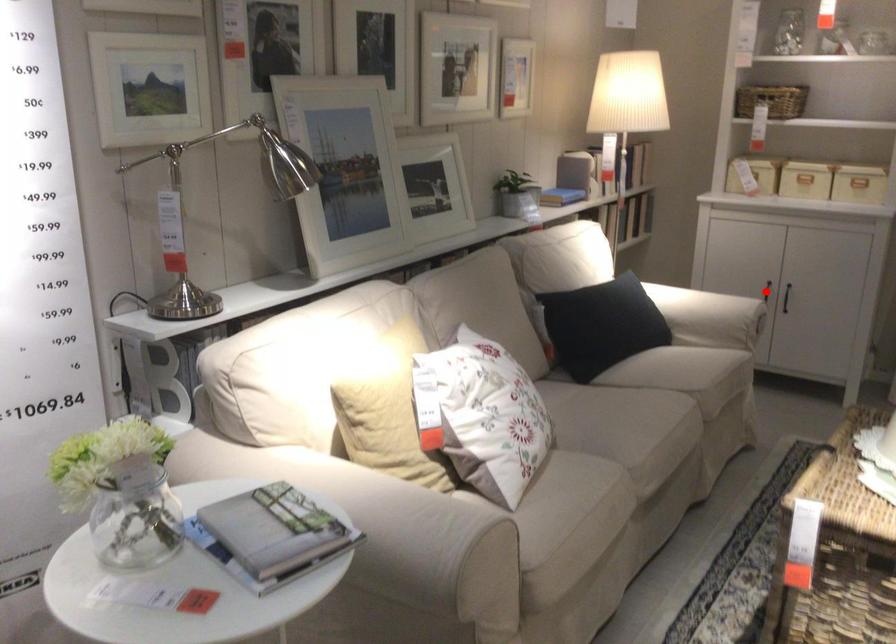
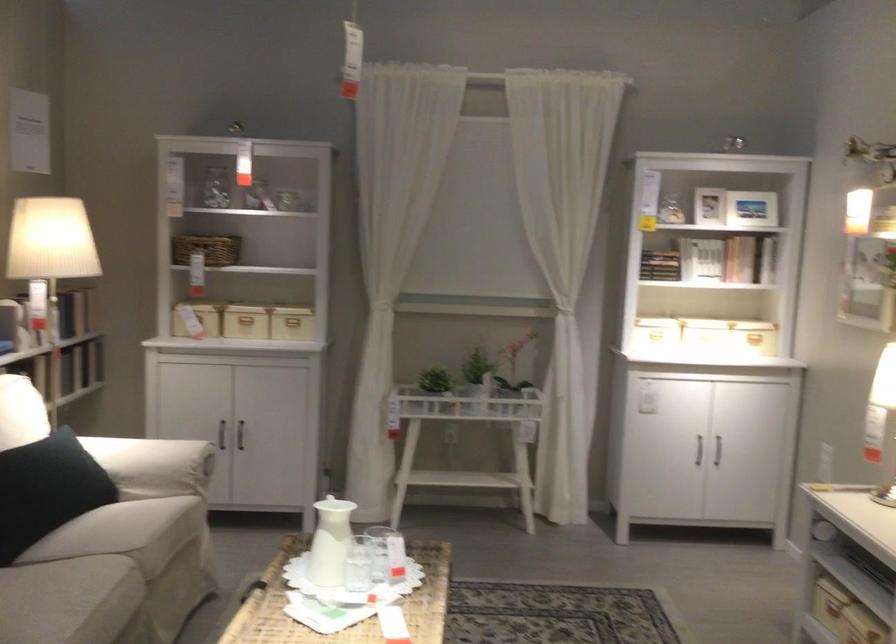
Question: I am providing you with two images of the same scene from different viewpoints. A red point is marked on the first image. Is the red point's position out of view in image 2?

Choices:
 (A) Yes
 (B) No

Answer: (A)